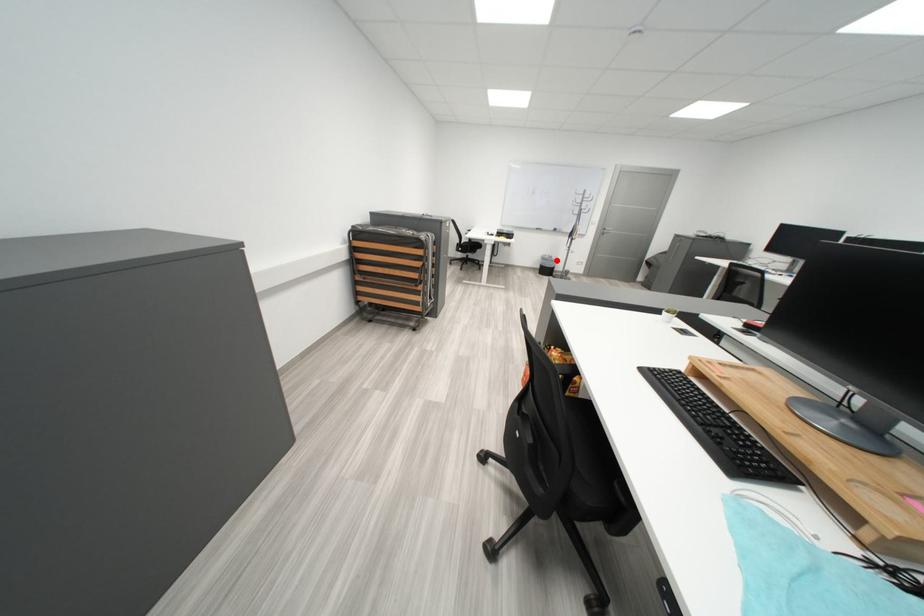
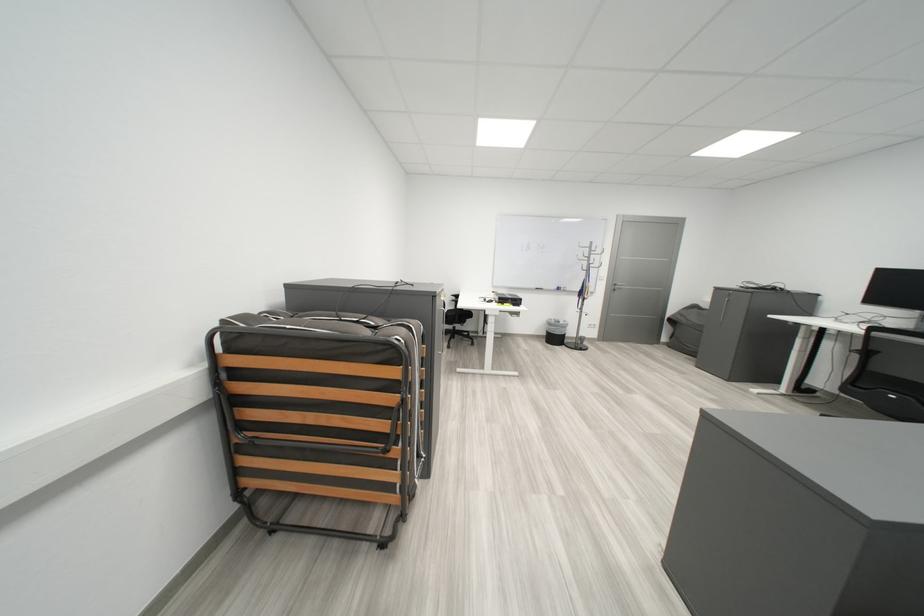
Find the pixel in the second image that matches the highlighted location in the first image.

(563, 326)